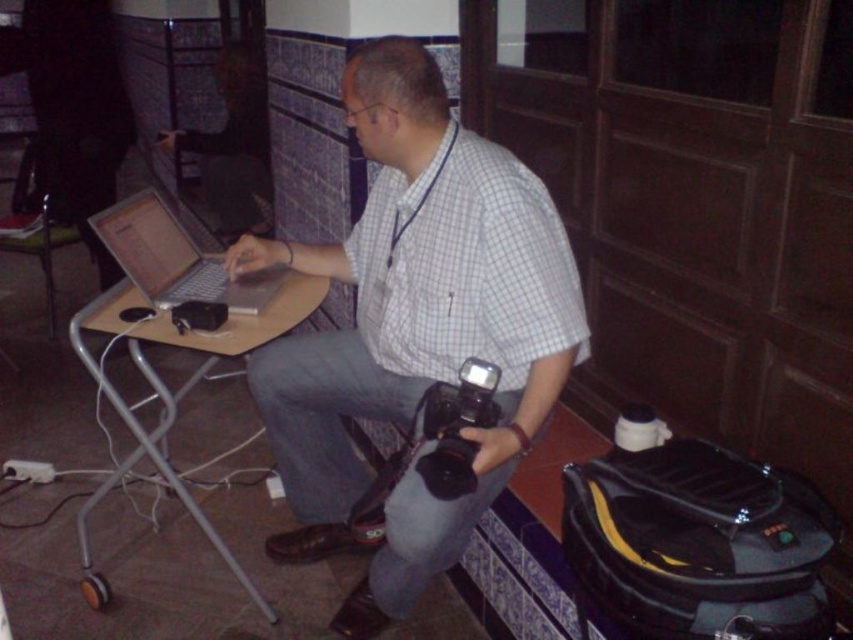
Question: Which of these objects is positioned closest to the black plastic video camera at lower center?

Choices:
 (A) silver metallic laptop at center
 (B) wooden table at center
 (C) white checkered shirt at center

Answer: (C)

Question: Is the position of wooden table at center more distant than that of black plastic video camera at lower center?

Choices:
 (A) yes
 (B) no

Answer: (A)

Question: Does wooden table at center have a larger size compared to black plastic video camera at lower center?

Choices:
 (A) no
 (B) yes

Answer: (B)

Question: Which object appears closest to the camera in this image?

Choices:
 (A) black plastic video camera at lower center
 (B) wooden table at center
 (C) white checkered shirt at center

Answer: (A)

Question: Does wooden table at center have a larger size compared to black plastic video camera at lower center?

Choices:
 (A) yes
 (B) no

Answer: (A)

Question: Which point is closer to the camera?

Choices:
 (A) (436, 401)
 (B) (228, 330)
 (C) (149, 244)

Answer: (A)